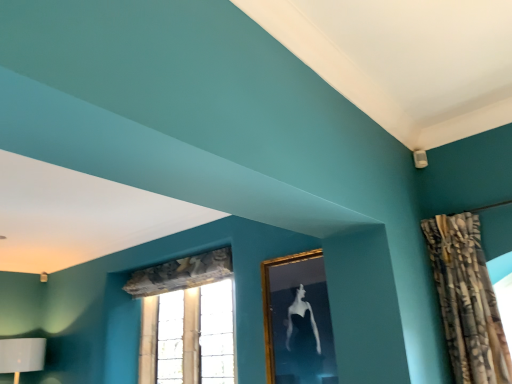
Describe the element at coordinates (467, 300) in the screenshot. The height and width of the screenshot is (384, 512). I see `textured beige curtain at upper right` at that location.

The height and width of the screenshot is (384, 512). Identify the location of textured beige curtain at upper right. (467, 300).

The image size is (512, 384). Find the location of `clear glass window at center`. clear glass window at center is located at coordinates (187, 320).

Looking at this image, is textured beige curtain at upper right oriented towards clear glass window at center?

No, textured beige curtain at upper right is not aimed at clear glass window at center.

Visually, is textured beige curtain at upper right positioned to the left or to the right of clear glass window at center?

From the image, it's evident that textured beige curtain at upper right is to the right of clear glass window at center.

Looking at this image, does textured beige curtain at upper right have a lesser width compared to clear glass window at center?

No, textured beige curtain at upper right is not thinner than clear glass window at center.

Looking at their sizes, would you say clear glass window at center is wider or thinner than gold-framed picture at upper center?

Considering their sizes, clear glass window at center looks broader than gold-framed picture at upper center.

How different are the orientations of clear glass window at center and gold-framed picture at upper center in degrees?

The angular difference between clear glass window at center and gold-framed picture at upper center is 0.747 degrees.

Considering the sizes of objects clear glass window at center and gold-framed picture at upper center in the image provided, who is taller, clear glass window at center or gold-framed picture at upper center?

Standing taller between the two is clear glass window at center.

From a real-world perspective, is clear glass window at center below gold-framed picture at upper center?

Yes, from a real-world perspective, clear glass window at center is beneath gold-framed picture at upper center.

From a real-world perspective, which is physically above, gold-framed picture at upper center or clear glass window at center?

gold-framed picture at upper center.

Is gold-framed picture at upper center positioned before clear glass window at center?

That is True.

How different are the orientations of gold-framed picture at upper center and clear glass window at center in degrees?

The facing directions of gold-framed picture at upper center and clear glass window at center are 0.747 degrees apart.

Based on their positions, is gold-framed picture at upper center located to the left or right of clear glass window at center?

Based on their positions, gold-framed picture at upper center is located to the right of clear glass window at center.

Is clear glass window at center oriented away from textured beige curtain at upper right?

No.

Which is further, (208, 292) or (486, 314)?

The point (208, 292) is more distant.

Consider the image. Is clear glass window at center closer to camera compared to textured beige curtain at upper right?

No.

Who is smaller, textured beige curtain at upper right or gold-framed picture at upper center?

gold-framed picture at upper center is smaller.

Is textured beige curtain at upper right looking in the opposite direction of gold-framed picture at upper center?

No, textured beige curtain at upper right is not facing the opposite direction of gold-framed picture at upper center.

Is textured beige curtain at upper right not close to gold-framed picture at upper center?

They are positioned close to each other.

Between textured beige curtain at upper right and gold-framed picture at upper center, which one has smaller width?

With smaller width is gold-framed picture at upper center.

Is point (318, 257) in front of point (461, 216)?

No, (318, 257) is further to viewer.

Consider the image. Between gold-framed picture at upper center and textured beige curtain at upper right, which one has more height?

textured beige curtain at upper right.

Is gold-framed picture at upper center facing towards textured beige curtain at upper right?

No, gold-framed picture at upper center is not facing towards textured beige curtain at upper right.

Considering the sizes of gold-framed picture at upper center and textured beige curtain at upper right in the image, is gold-framed picture at upper center wider or thinner than textured beige curtain at upper right?

In the image, gold-framed picture at upper center appears to be more narrow than textured beige curtain at upper right.

This screenshot has height=384, width=512. I want to click on curtain in front of the clear glass window at center, so click(467, 300).

The width and height of the screenshot is (512, 384). What are the coordinates of `window located on the left of gold-framed picture at upper center` in the screenshot? It's located at (187, 320).

Which object lies nearer to the anchor point gold-framed picture at upper center, clear glass window at center or textured beige curtain at upper right?

The object closer to gold-framed picture at upper center is textured beige curtain at upper right.

From the image, which object appears to be nearer to textured beige curtain at upper right, clear glass window at center or gold-framed picture at upper center?

gold-framed picture at upper center is positioned closer to the anchor textured beige curtain at upper right.

When comparing their distances from textured beige curtain at upper right, does gold-framed picture at upper center or clear glass window at center seem closer?

Among the two, gold-framed picture at upper center is located nearer to textured beige curtain at upper right.

Looking at the image, which one is located further to clear glass window at center, gold-framed picture at upper center or textured beige curtain at upper right?

Among the two, textured beige curtain at upper right is located further to clear glass window at center.

From the image, which object appears to be farther from gold-framed picture at upper center, textured beige curtain at upper right or clear glass window at center?

clear glass window at center is further to gold-framed picture at upper center.

Considering their positions, is textured beige curtain at upper right positioned closer to clear glass window at center than gold-framed picture at upper center?

gold-framed picture at upper center lies closer to clear glass window at center than the other object.

Locate an element on the screen. The height and width of the screenshot is (384, 512). picture frame located between textured beige curtain at upper right and clear glass window at center in the depth direction is located at coordinates (298, 320).